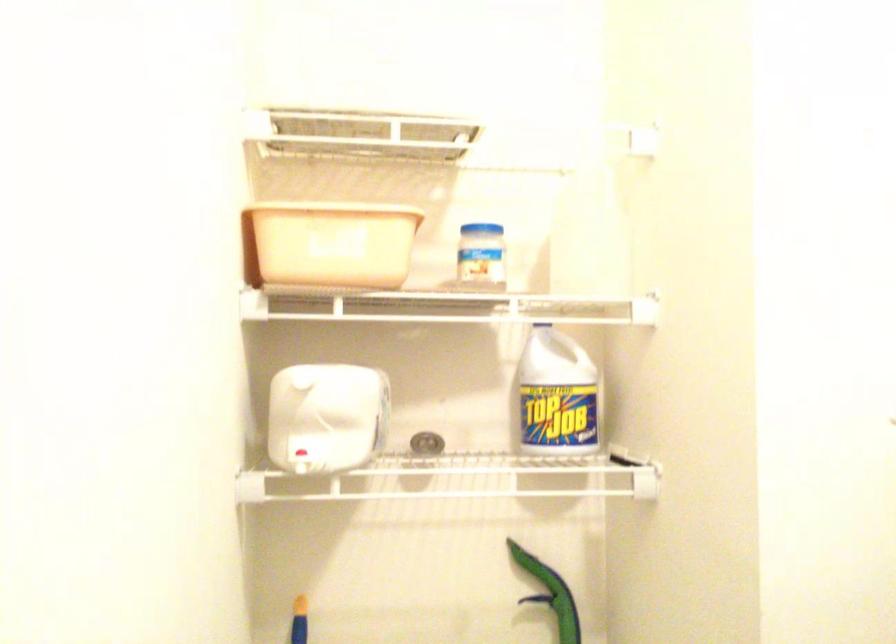
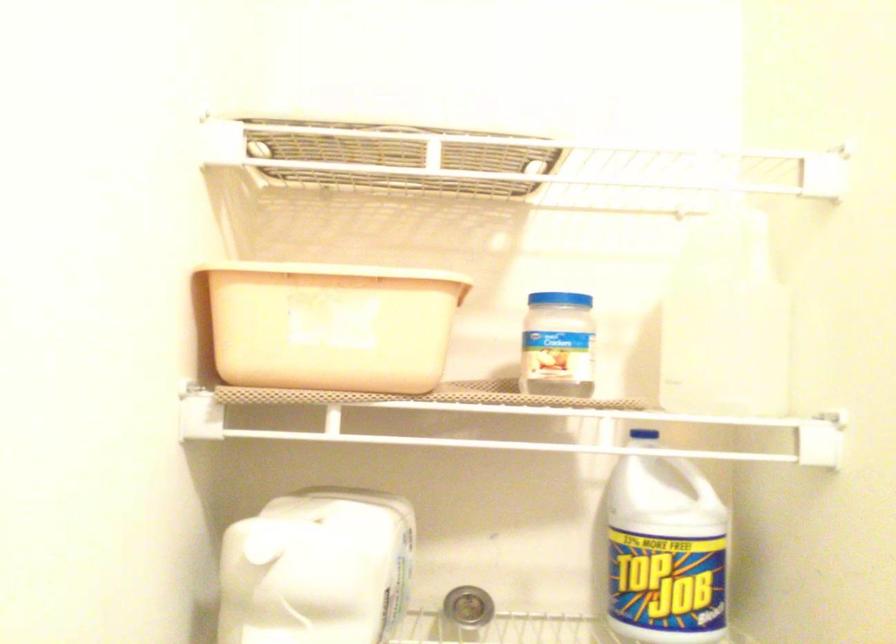
Where in the second image is the point corresponding to the point at 332,243 from the first image?

(330, 325)